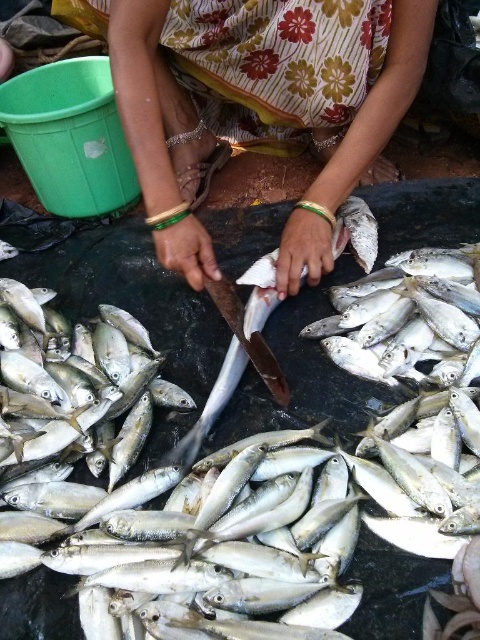
Question: Can you confirm if floral fabric skirt at center is smaller than shiny silver fish at center?

Choices:
 (A) no
 (B) yes

Answer: (A)

Question: Which point is farther to the camera?

Choices:
 (A) floral fabric skirt at center
 (B) shiny silver fish at center

Answer: (B)

Question: Does floral fabric skirt at center appear over shiny silver fish at center?

Choices:
 (A) no
 (B) yes

Answer: (B)

Question: Which point is farther to the camera?

Choices:
 (A) floral fabric skirt at center
 (B) shiny silver fish at center

Answer: (B)

Question: Can you confirm if floral fabric skirt at center is positioned above shiny silver fish at center?

Choices:
 (A) yes
 (B) no

Answer: (A)